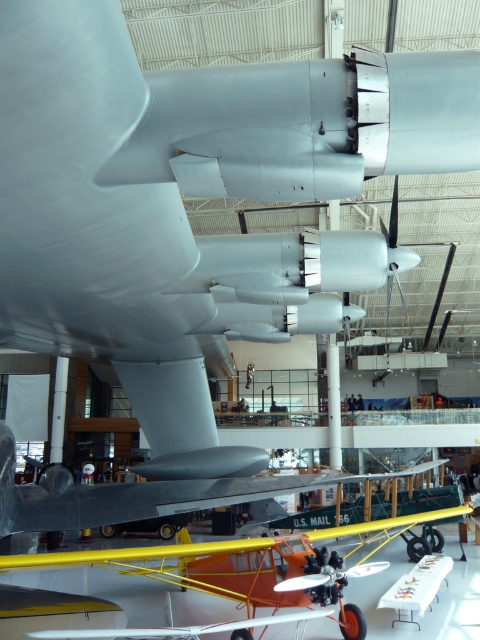
Consider the image. You are a visitor at the aviation museum and want to take a photo of both the orange matte airplane at lower center and the metallic silver airplane at center. Which airplane should you stand closer to in order to include both in your camera frame?

Since the orange matte airplane at lower center is much taller than the metallic silver airplane at center, you should stand closer to the metallic silver airplane at center to ensure both fit within the camera frame.

You are a museum guide explaining the aircrafts to visitors. You need to mention the size relationship between the orange matte airplane at lower center and the metallic silver airplane at center. What do you say?

The orange matte airplane at lower center is smaller in size compared to the metallic silver airplane at center.